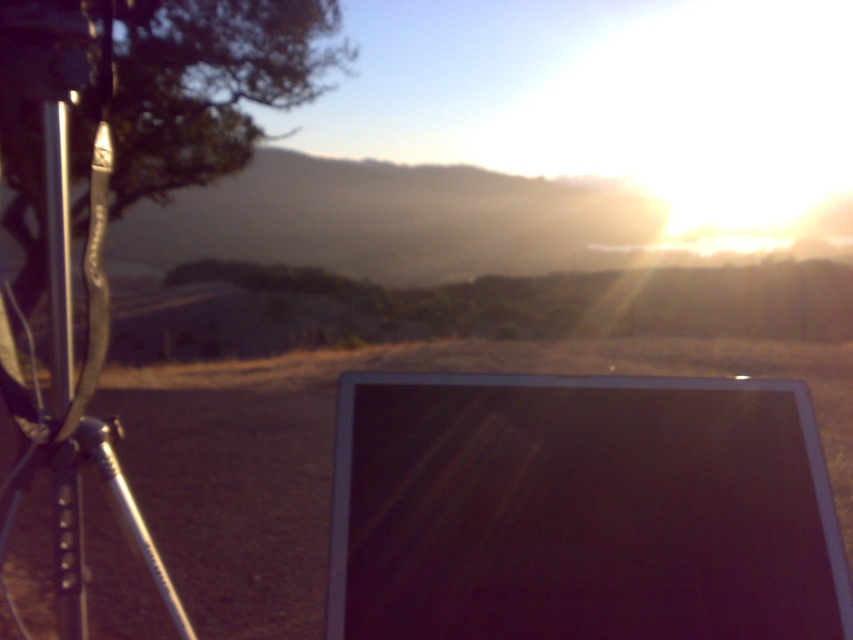
Who is positioned more to the right, silver metallic tripod at left or metallic silver pole at left?

Positioned to the right is silver metallic tripod at left.

How much distance is there between silver metallic tripod at left and metallic silver pole at left?

1.75 inches

I want to click on silver metallic tripod at left, so click(67, 301).

Based on the photo, who is positioned more to the right, dirt field at lower center or metallic silver pole at left?

metallic silver pole at left is more to the right.

Between point (25, 604) and point (57, 609), which one is positioned behind?

The point (25, 604) is behind.

Locate an element on the screen. The height and width of the screenshot is (640, 853). dirt field at lower center is located at coordinates (332, 452).

Is dirt field at lower center positioned before silver metallic tripod at left?

Yes.

Which of these two, dirt field at lower center or silver metallic tripod at left, stands taller?

With more height is silver metallic tripod at left.

The width and height of the screenshot is (853, 640). I want to click on dirt field at lower center, so click(x=332, y=452).

Where is `dirt field at lower center`? This screenshot has width=853, height=640. dirt field at lower center is located at coordinates click(x=332, y=452).